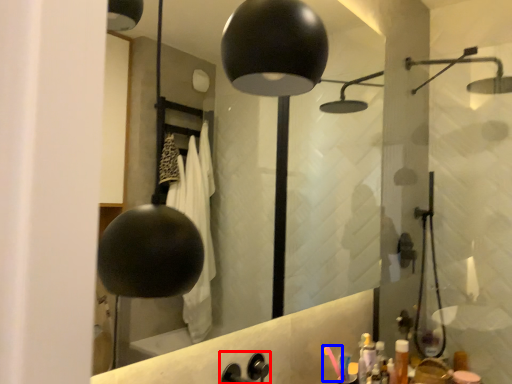
Question: Which of the following is the closest to the observer, faucet (highlighted by a red box) or toothbrush (highlighted by a blue box)?

Choices:
 (A) faucet
 (B) toothbrush

Answer: (A)